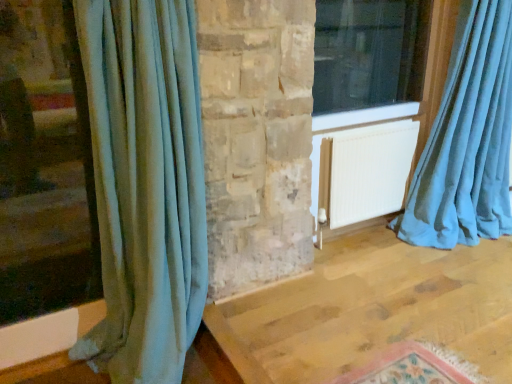
Question: From a real-world perspective, is white matte radiator at center physically above teal velvet curtain at right, the first curtain when ordered from right to left?

Choices:
 (A) no
 (B) yes

Answer: (A)

Question: From the image's perspective, is white matte radiator at center under teal velvet curtain at right, acting as the second curtain starting from the left?

Choices:
 (A) no
 (B) yes

Answer: (B)

Question: From the image's perspective, is white matte radiator at center over teal velvet curtain at right, the first curtain when ordered from right to left?

Choices:
 (A) no
 (B) yes

Answer: (A)

Question: From a real-world perspective, is white matte radiator at center below teal velvet curtain at right, acting as the second curtain starting from the left?

Choices:
 (A) no
 (B) yes

Answer: (B)

Question: Is white matte radiator at center taller than teal velvet curtain at right, the first curtain when ordered from right to left?

Choices:
 (A) yes
 (B) no

Answer: (B)

Question: Does white matte radiator at center touch teal velvet curtain at right, acting as the second curtain starting from the left?

Choices:
 (A) no
 (B) yes

Answer: (A)

Question: Is transparent glass window at upper right shorter than velvet teal curtain at left, the first curtain from the left?

Choices:
 (A) yes
 (B) no

Answer: (A)

Question: From a real-world perspective, is transparent glass window at upper right located beneath velvet teal curtain at left, which ranks as the second curtain in right-to-left order?

Choices:
 (A) no
 (B) yes

Answer: (A)

Question: Does transparent glass window at upper right lie in front of velvet teal curtain at left, the first curtain from the left?

Choices:
 (A) yes
 (B) no

Answer: (B)

Question: Does transparent glass window at upper right appear on the left side of velvet teal curtain at left, the first curtain from the left?

Choices:
 (A) yes
 (B) no

Answer: (B)

Question: Is transparent glass window at upper right directly adjacent to velvet teal curtain at left, which ranks as the second curtain in right-to-left order?

Choices:
 (A) no
 (B) yes

Answer: (A)

Question: Does transparent glass window at upper right have a lesser width compared to velvet teal curtain at left, which ranks as the second curtain in right-to-left order?

Choices:
 (A) no
 (B) yes

Answer: (A)

Question: Considering the relative sizes of velvet teal curtain at left, which ranks as the second curtain in right-to-left order, and white matte radiator at center in the image provided, is velvet teal curtain at left, which ranks as the second curtain in right-to-left order, thinner than white matte radiator at center?

Choices:
 (A) yes
 (B) no

Answer: (A)